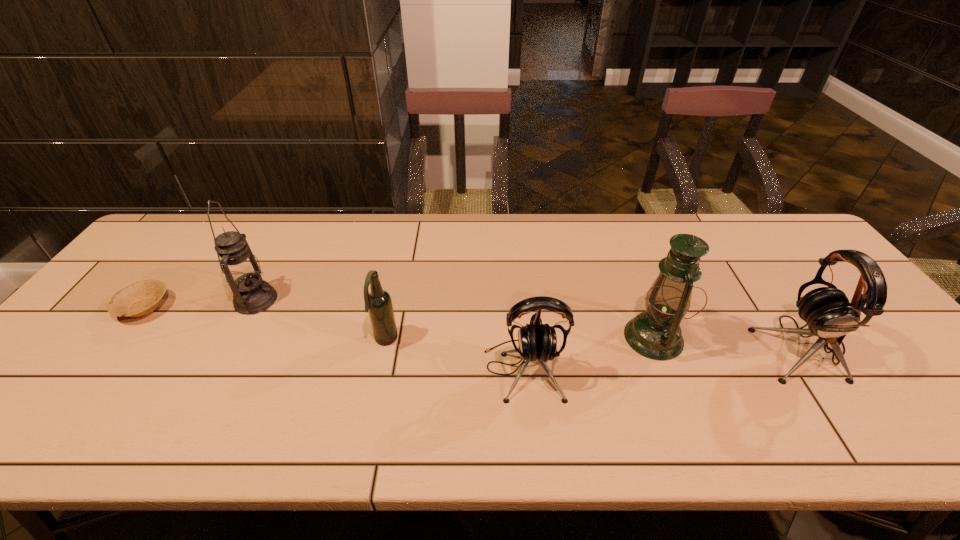
Please show where to add a earphone on the left while keeping spacing even. Please provide its 2D coordinates. Your answer should be formatted as a tuple, i.e. [(x, y)], where the tuple contains the x and y coordinates of a point satisfying the conditions above.

[(217, 396)]